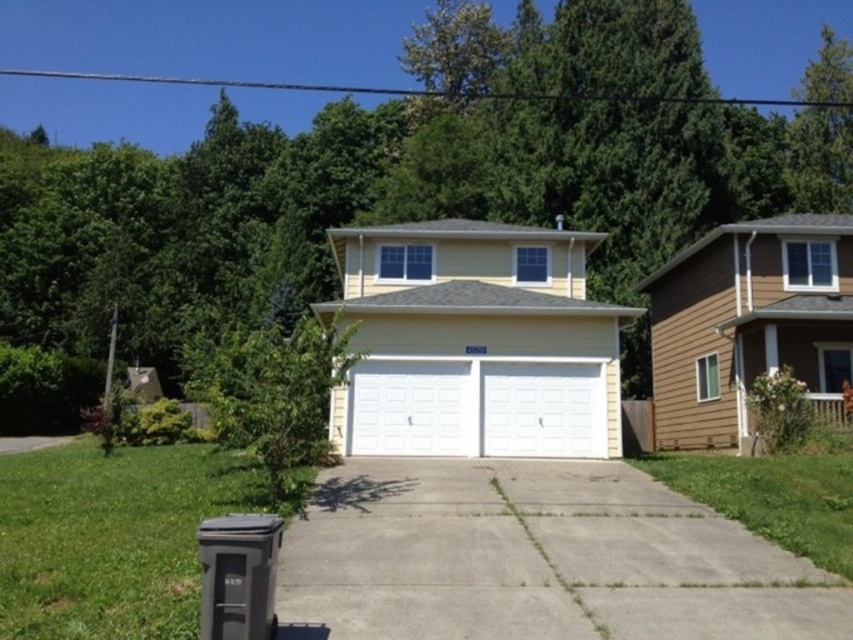
Can you confirm if white textured garage door at center is shorter than gray concrete driveway at lower left?

No.

Who is more distant from viewer, (x=582, y=422) or (x=45, y=445)?

Point (x=45, y=445)

Image resolution: width=853 pixels, height=640 pixels. I want to click on white textured garage door at center, so click(x=543, y=410).

Between brown wood siding garage at right and gray concrete driveway at lower left, which one has more height?

Standing taller between the two is gray concrete driveway at lower left.

Is point (805, 326) positioned behind point (10, 451)?

No, (805, 326) is in front of (10, 451).

This screenshot has height=640, width=853. I want to click on brown wood siding garage at right, so pos(747,323).

Does gray concrete driveway at center have a lesser width compared to white smooth garage door at center?

No, gray concrete driveway at center is not thinner than white smooth garage door at center.

Who is positioned more to the right, gray concrete driveway at center or white smooth garage door at center?

From the viewer's perspective, gray concrete driveway at center appears more on the right side.

You are a GUI agent. You are given a task and a screenshot of the screen. Output one action in this format:
    pyautogui.click(x=<x>, y=<y>)
    Task: Click on the gray concrete driveway at center
    The width and height of the screenshot is (853, 640).
    Given the screenshot: What is the action you would take?
    click(x=537, y=557)